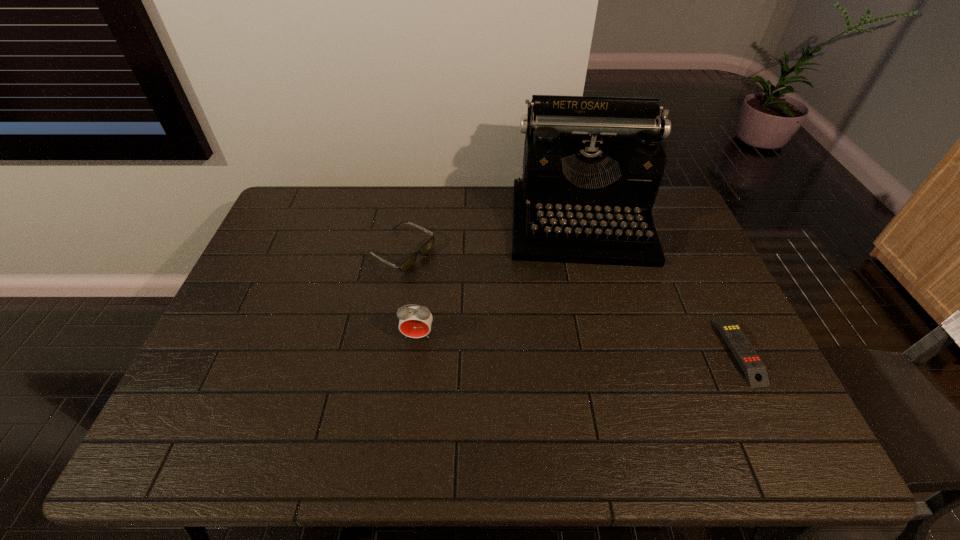
The width and height of the screenshot is (960, 540). Identify the location of blank space at the far edge of the desktop. (511, 188).

In the image, there is a desktop. Identify the location of vacant area at the near edge. (616, 386).

In the image, there is a desktop. At what (x,y) coordinates should I click in order to perform the action: click on vacant area at the left edge. Please return your answer as a coordinate pair (x, y). This screenshot has width=960, height=540. Looking at the image, I should click on (273, 314).

Where is `vacant space at the right edge`? The image size is (960, 540). vacant space at the right edge is located at coordinates (703, 325).

Locate an element on the screen. Image resolution: width=960 pixels, height=540 pixels. free space between the remote control and the tallest object is located at coordinates (660, 287).

In order to click on empty space between the second tallest object and the sunglasses in this screenshot , I will do `click(409, 294)`.

The width and height of the screenshot is (960, 540). What are the coordinates of `free space that is in between the shortest object and the sunglasses` in the screenshot? It's located at (569, 302).

At what (x,y) coordinates should I click in order to perform the action: click on free spot between the tallest object and the shortest object. Please return your answer as a coordinate pair (x, y). Looking at the image, I should click on tap(660, 287).

Identify the location of empty location between the typewriter and the sunglasses. The width and height of the screenshot is (960, 540). (491, 238).

Find the location of a particular element. The width and height of the screenshot is (960, 540). blank region between the rightmost object and the alarm clock is located at coordinates (578, 343).